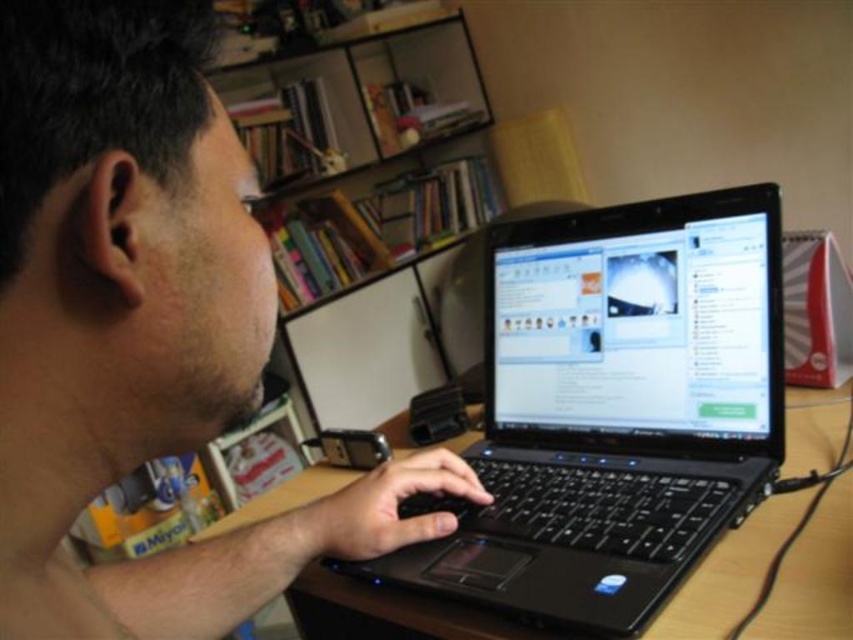
Question: Is black plastic laptop at center thinner than wooden table at center?

Choices:
 (A) no
 (B) yes

Answer: (B)

Question: Can you confirm if matte black laptop at center is bigger than black plastic laptop at center?

Choices:
 (A) yes
 (B) no

Answer: (B)

Question: Can you confirm if matte black laptop at center is positioned to the right of black plastic laptop at center?

Choices:
 (A) no
 (B) yes

Answer: (A)

Question: Which point is closer to the camera?

Choices:
 (A) shiny black laptop screen at center
 (B) wooden table at center

Answer: (B)

Question: Which of the following is the farthest from the observer?

Choices:
 (A) (364, 102)
 (B) (785, 502)
 (C) (199, 317)

Answer: (A)

Question: Which object is the closest to the matte black laptop at center?

Choices:
 (A) wooden shelves at upper center
 (B) shiny black laptop screen at center
 (C) black plastic laptop at center

Answer: (C)